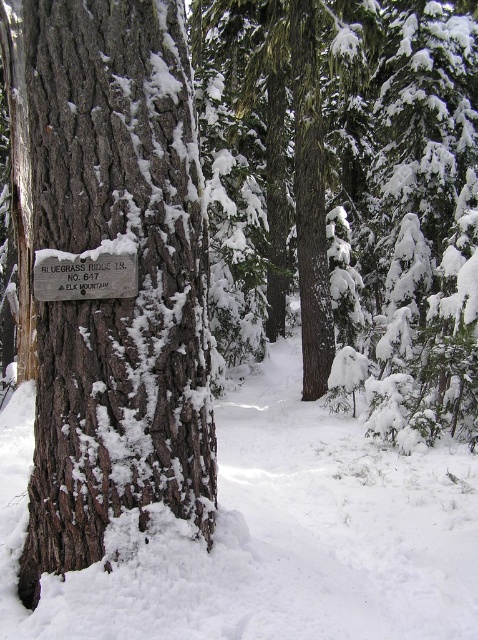
From the picture: You are a hiker who wants to read the silver metallic sign at left while standing near the dark brown textured bark at center. Which direction should you move to face the sign?

The dark brown textured bark at center is positioned on the right side of the silver metallic sign at left. Therefore, to face the silver metallic sign at left, you should move to your left so that the sign comes into view on your left side.

In the scene shown: You are an artist preparing to sketch this winter forest scene. You want to ensure the dark brown textured bark at center and the silver metallic sign at left are proportionally accurate. Which object should you draw wider in your sketch?

The dark brown textured bark at center should be drawn wider than the silver metallic sign at left because its width surpasses the sign according to the description.

You are standing at the center of the image and want to step onto the white fluffy snow at lower center. Which direction should you move to reach it?

Since the white fluffy snow at lower center is located at coordinate point 0.838 in the x axis and 0.573 in the y axis, you should move to the right and slightly downward from the center to reach it.